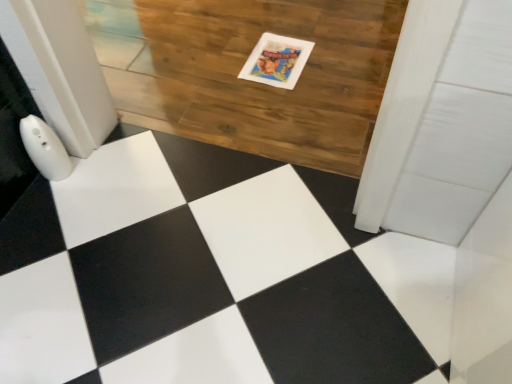
Locate an element on the screen. The width and height of the screenshot is (512, 384). vacant position to the left of matte paper postcard at upper center is located at coordinates (217, 61).